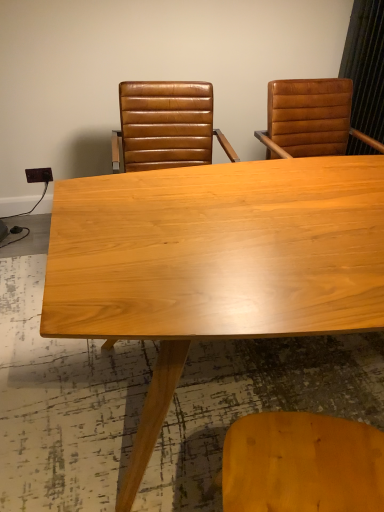
Question: Is leather at right, the second chair positioned from the left, in front of or behind brown leather chair at upper center, which ranks as the 2th chair in right-to-left order, in the image?

Choices:
 (A) front
 (B) behind

Answer: (B)

Question: In the image, is leather at right, the second chair positioned from the left, on the left side or the right side of brown leather chair at upper center, which ranks as the 2th chair in right-to-left order?

Choices:
 (A) left
 (B) right

Answer: (B)

Question: Based on their relative distances, which object is farther from the light wood table at center?

Choices:
 (A) leather at right, the 1th chair when ordered from right to left
 (B) brown leather chair at upper center, which ranks as the 2th chair in right-to-left order

Answer: (A)

Question: Considering the real-world distances, which object is closest to the brown leather chair at upper center, which ranks as the 2th chair in right-to-left order?

Choices:
 (A) light wood table at center
 (B) leather at right, the second chair positioned from the left

Answer: (B)